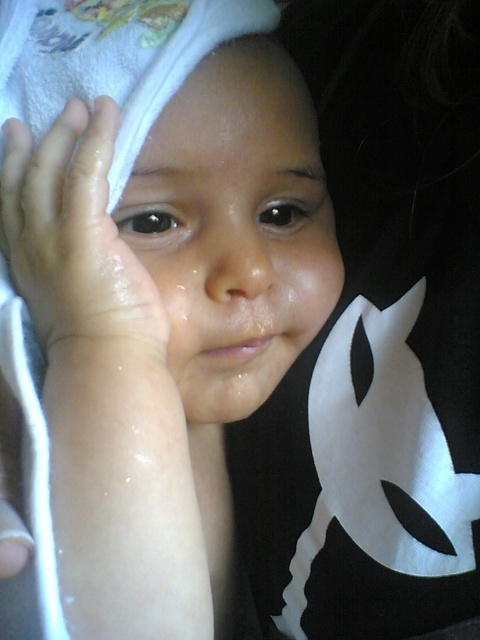
Is white towel at upper left shorter than smooth skin face at center?

No.

Is white towel at upper left taller than smooth skin face at center?

Indeed, white towel at upper left has a greater height compared to smooth skin face at center.

Find the location of a particular element. white towel at upper left is located at coordinates (147, 292).

At what (x,y) coordinates should I click in order to perform the action: click on white towel at upper left. Please return your answer as a coordinate pair (x, y). Looking at the image, I should click on (147, 292).

Based on the photo, can you confirm if white towel at upper left is positioned to the left of slightly wet skin at upper left?

Incorrect, white towel at upper left is not on the left side of slightly wet skin at upper left.

Does white towel at upper left appear over slightly wet skin at upper left?

No, white towel at upper left is not above slightly wet skin at upper left.

This screenshot has height=640, width=480. What do you see at coordinates (147, 292) in the screenshot? I see `white towel at upper left` at bounding box center [147, 292].

Locate an element on the screen. white towel at upper left is located at coordinates (147, 292).

Which of these two, smooth skin face at center or slightly wet skin at upper left, stands taller?

smooth skin face at center

Does smooth skin face at center appear over slightly wet skin at upper left?

Yes, smooth skin face at center is above slightly wet skin at upper left.

Identify the location of smooth skin face at center. The height and width of the screenshot is (640, 480). (235, 227).